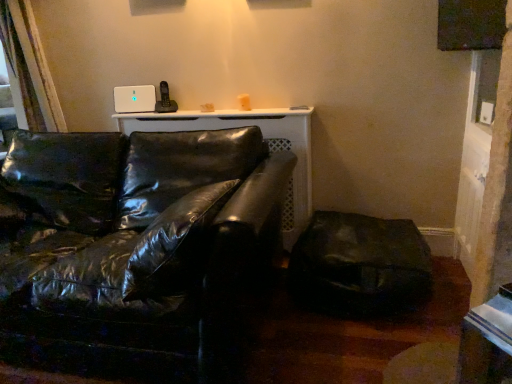
Question: Does matte black swivel chair at lower right have a greater height compared to glossy black leather couch at center?

Choices:
 (A) yes
 (B) no

Answer: (B)

Question: From a real-world perspective, is matte black swivel chair at lower right beneath glossy black leather couch at center?

Choices:
 (A) no
 (B) yes

Answer: (B)

Question: Does matte black swivel chair at lower right have a lesser width compared to glossy black leather couch at center?

Choices:
 (A) no
 (B) yes

Answer: (B)

Question: Does matte black swivel chair at lower right lie in front of glossy black leather couch at center?

Choices:
 (A) yes
 (B) no

Answer: (B)

Question: Is matte black swivel chair at lower right placed right next to glossy black leather couch at center?

Choices:
 (A) yes
 (B) no

Answer: (B)

Question: From a real-world perspective, is matte black swivel chair at lower right positioned over glossy black leather couch at center based on gravity?

Choices:
 (A) no
 (B) yes

Answer: (A)

Question: Does matte black window screen at upper right appear on the left side of matte black swivel chair at lower right?

Choices:
 (A) yes
 (B) no

Answer: (B)

Question: Are matte black window screen at upper right and matte black swivel chair at lower right located far from each other?

Choices:
 (A) no
 (B) yes

Answer: (B)

Question: Is matte black window screen at upper right taller than matte black swivel chair at lower right?

Choices:
 (A) yes
 (B) no

Answer: (B)

Question: From a real-world perspective, is matte black window screen at upper right positioned over matte black swivel chair at lower right based on gravity?

Choices:
 (A) no
 (B) yes

Answer: (B)

Question: Is matte black window screen at upper right completely or partially outside of matte black swivel chair at lower right?

Choices:
 (A) no
 (B) yes

Answer: (B)

Question: Is matte black window screen at upper right shorter than matte black swivel chair at lower right?

Choices:
 (A) yes
 (B) no

Answer: (A)

Question: Is matte black window screen at upper right next to glossy black leather couch at center?

Choices:
 (A) yes
 (B) no

Answer: (B)